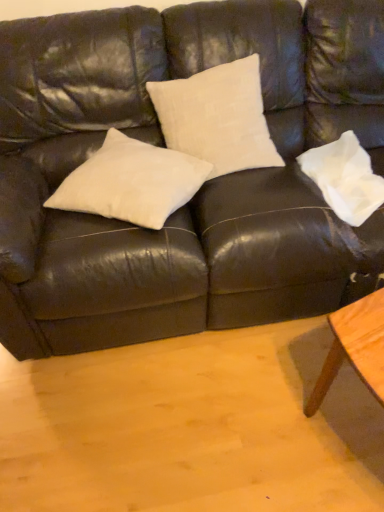
Question: Can you confirm if matte black leather couch at center is wider than white cotton pillow at right, the 2th pillow viewed from the left?

Choices:
 (A) no
 (B) yes

Answer: (B)

Question: From a real-world perspective, is matte black leather couch at center over white cotton pillow at right, the 2th pillow viewed from the left?

Choices:
 (A) no
 (B) yes

Answer: (B)

Question: Is matte black leather couch at center positioned behind white cotton pillow at right, the 2th pillow viewed from the left?

Choices:
 (A) no
 (B) yes

Answer: (A)

Question: Is matte black leather couch at center next to white cotton pillow at right, marked as the 1th pillow in a right-to-left arrangement?

Choices:
 (A) yes
 (B) no

Answer: (B)

Question: Considering the relative sizes of matte black leather couch at center and white cotton pillow at right, the 2th pillow viewed from the left, in the image provided, is matte black leather couch at center smaller than white cotton pillow at right, the 2th pillow viewed from the left,?

Choices:
 (A) yes
 (B) no

Answer: (B)

Question: In terms of height, does matte black leather couch at center look taller or shorter compared to white cotton pillow at center, placed as the 2th pillow when sorted from right to left?

Choices:
 (A) short
 (B) tall

Answer: (B)

Question: From a real-world perspective, is matte black leather couch at center above or below white cotton pillow at center, placed as the 2th pillow when sorted from right to left?

Choices:
 (A) above
 (B) below

Answer: (B)

Question: Is matte black leather couch at center bigger or smaller than white cotton pillow at center, placed as the 2th pillow when sorted from right to left?

Choices:
 (A) small
 (B) big

Answer: (B)

Question: Would you say matte black leather couch at center is to the left or to the right of white cotton pillow at center, placed as the 2th pillow when sorted from right to left, in the picture?

Choices:
 (A) right
 (B) left

Answer: (A)

Question: Which is correct: white cotton pillow at center, the first pillow in the left-to-right sequence, is inside matte black leather couch at center, or outside of it?

Choices:
 (A) outside
 (B) inside

Answer: (B)

Question: From a real-world perspective, relative to matte black leather couch at center, is white cotton pillow at center, placed as the 2th pillow when sorted from right to left, vertically above or below?

Choices:
 (A) below
 (B) above

Answer: (B)

Question: From the image's perspective, is white cotton pillow at center, placed as the 2th pillow when sorted from right to left, above or below matte black leather couch at center?

Choices:
 (A) above
 (B) below

Answer: (B)

Question: In the image, is white cotton pillow at center, placed as the 2th pillow when sorted from right to left, positioned in front of or behind matte black leather couch at center?

Choices:
 (A) behind
 (B) front

Answer: (A)

Question: Is white cotton pillow at right, the 2th pillow viewed from the left, inside the boundaries of white cotton pillow at center, placed as the 2th pillow when sorted from right to left, or outside?

Choices:
 (A) inside
 (B) outside

Answer: (B)

Question: Based on their positions, is white cotton pillow at right, the 2th pillow viewed from the left, located to the left or right of white cotton pillow at center, the first pillow in the left-to-right sequence?

Choices:
 (A) right
 (B) left

Answer: (A)